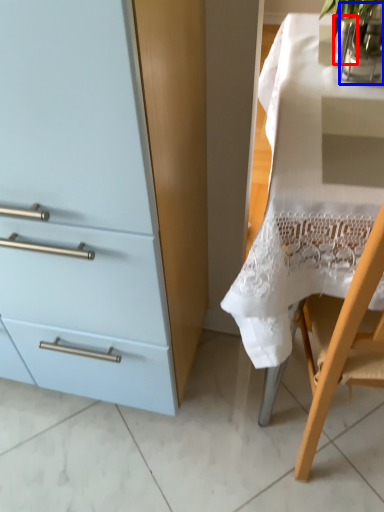
Question: Which object appears closest to the camera in this image, glass vase (highlighted by a red box) or glass vase (highlighted by a blue box)?

Choices:
 (A) glass vase
 (B) glass vase

Answer: (B)